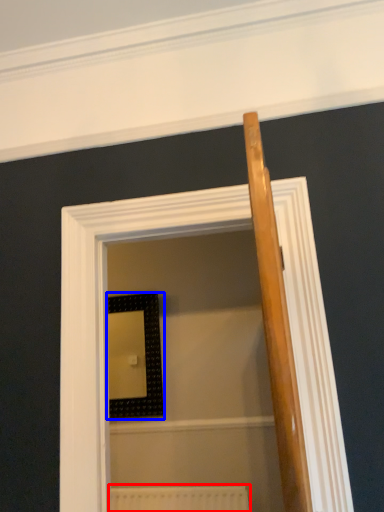
Question: Among these objects, which one is nearest to the camera, radiator (highlighted by a red box) or picture frame (highlighted by a blue box)?

Choices:
 (A) radiator
 (B) picture frame

Answer: (A)